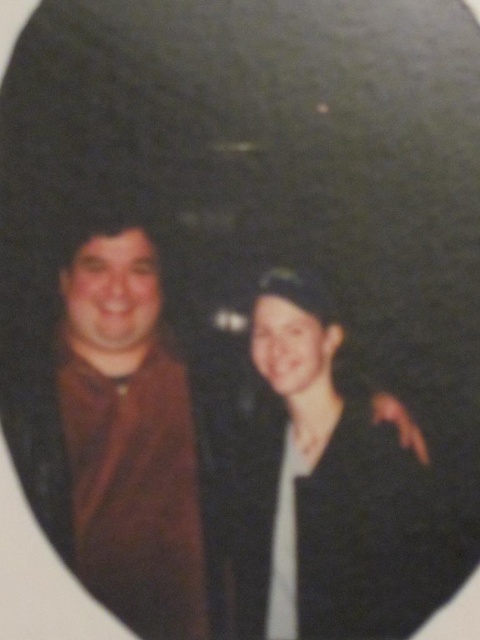
You are a tailor who needs to determine which garment requires more fabric for alterations. Based on the image, which item would need more fabric, the matte black jacket at center or the brown matte shirt at left?

The matte black jacket at center requires more fabric for alterations since it is bigger than the brown matte shirt at left.

You are a photographer reviewing an old photo. You notice two items in the image. One is the matte black jacket at center and the other is the brown matte shirt at left. Based on their positions, which item is closer to the camera?

The matte black jacket at center is closer to the camera because it is in front of the brown matte shirt at left.